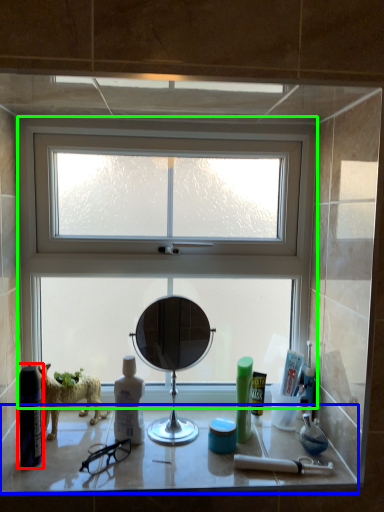
Question: Which object is positioned farthest from cleaning product (highlighted by a red box)? Select from counter top (highlighted by a blue box) and window (highlighted by a green box).

Choices:
 (A) counter top
 (B) window

Answer: (B)